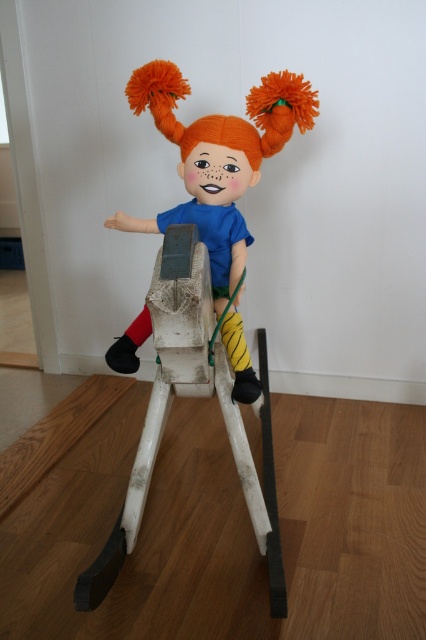
Which is below, knitted orange doll at center or white matte wooden rocking horse at center?

white matte wooden rocking horse at center is lower down.

This screenshot has height=640, width=426. What do you see at coordinates (218, 157) in the screenshot? I see `knitted orange doll at center` at bounding box center [218, 157].

Image resolution: width=426 pixels, height=640 pixels. In order to click on knitted orange doll at center in this screenshot , I will do `click(218, 157)`.

Identify the location of knitted orange doll at center. (218, 157).